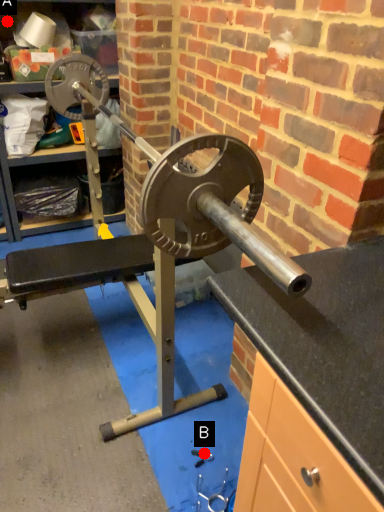
Question: Two points are circled on the image, labeled by A and B beside each circle. Which point is closer to the camera taking this photo?

Choices:
 (A) A is closer
 (B) B is closer

Answer: (B)